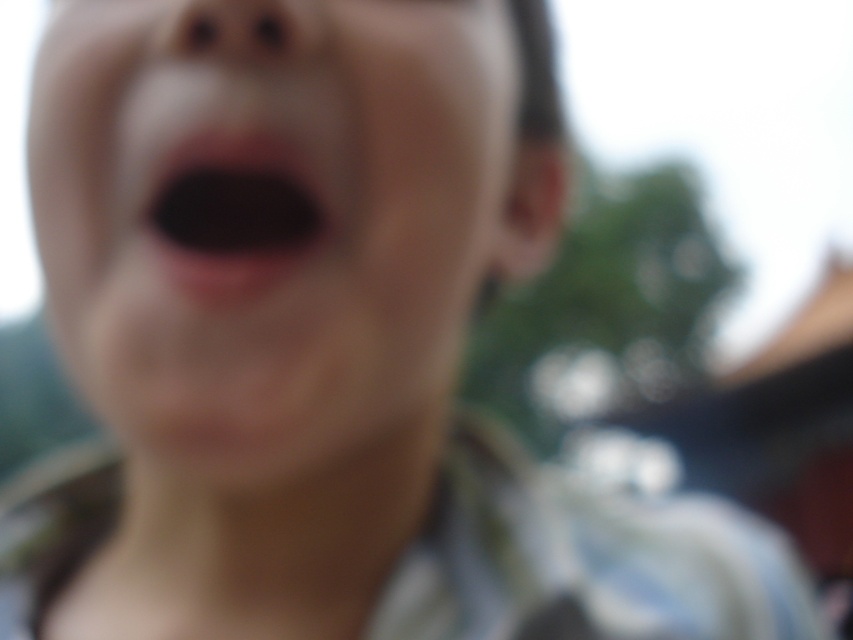
Can you confirm if smooth skin face at center is thinner than black matte mouth at center?

No, smooth skin face at center is not thinner than black matte mouth at center.

Consider the image. Does smooth skin face at center appear on the left side of black matte mouth at center?

Incorrect, smooth skin face at center is not on the left side of black matte mouth at center.

Does point (277, 310) come closer to viewer compared to point (317, 205)?

Yes, it is.

I want to click on smooth skin face at center, so click(270, 225).